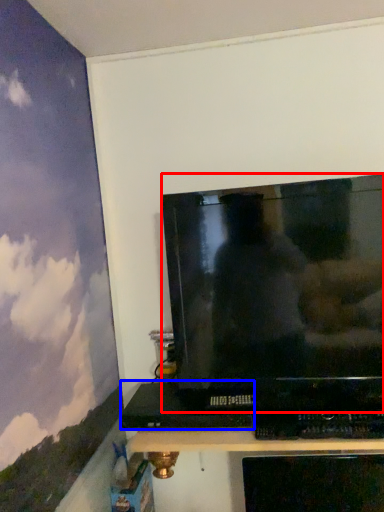
Question: Which object is closer to the camera taking this photo, television (highlighted by a red box) or computer (highlighted by a blue box)?

Choices:
 (A) television
 (B) computer

Answer: (A)